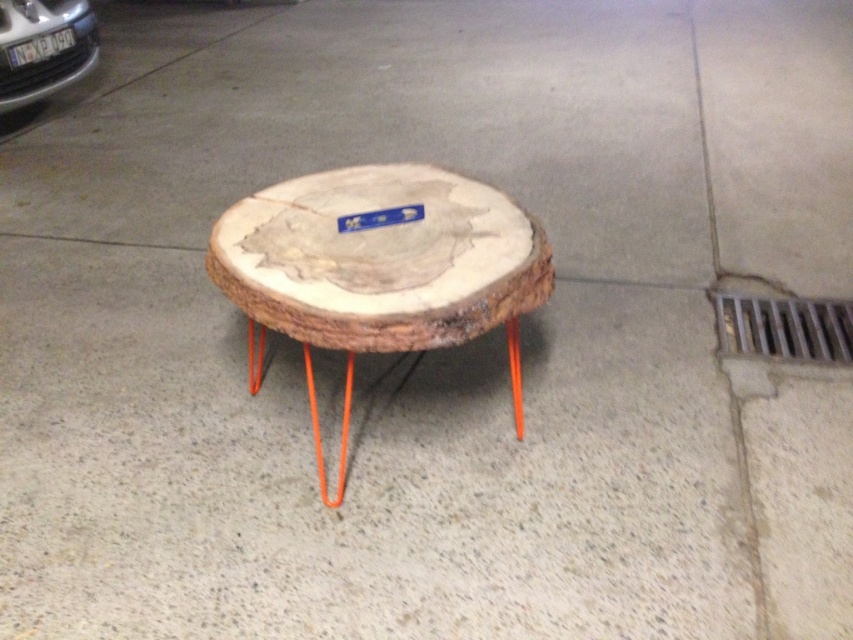
Question: Which point is farther from the camera taking this photo?

Choices:
 (A) (306, 264)
 (B) (91, 26)

Answer: (B)

Question: Is natural wood table at center bigger than matte black car at upper left?

Choices:
 (A) no
 (B) yes

Answer: (B)

Question: Does natural wood table at center appear over matte black car at upper left?

Choices:
 (A) no
 (B) yes

Answer: (A)

Question: Which point appears closest to the camera in this image?

Choices:
 (A) (316, 236)
 (B) (22, 74)

Answer: (A)

Question: Which object appears farthest from the camera in this image?

Choices:
 (A) natural wood table at center
 (B) matte black car at upper left

Answer: (B)

Question: Does natural wood table at center have a lesser width compared to matte black car at upper left?

Choices:
 (A) yes
 (B) no

Answer: (B)